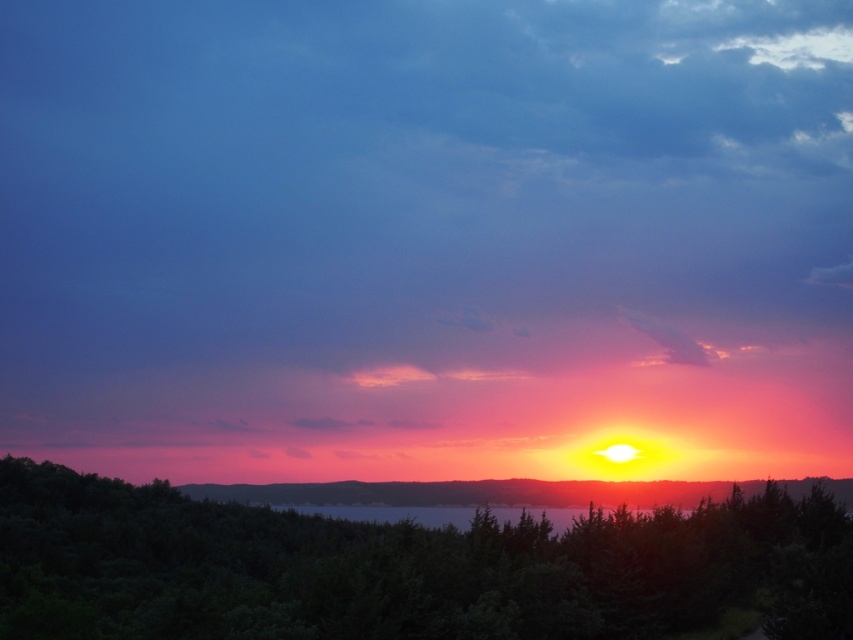
You are an artist trying to paint the sunset scene. You notice the smooth orange sky at center and the translucent glass water at center. Which object should you paint first if you want to follow the correct layering based on their positions?

You should paint the translucent glass water at center first because the smooth orange sky at center is positioned under it, meaning the water appears above the sky in the scene.

You are standing at the point marked by the coordinates point (x=405, y=568) in the image. Looking around, what object is directly in front of you?

The point (x=405, y=568) corresponds to the green leafy tree at center, so the green leafy tree at center is directly in front of you.